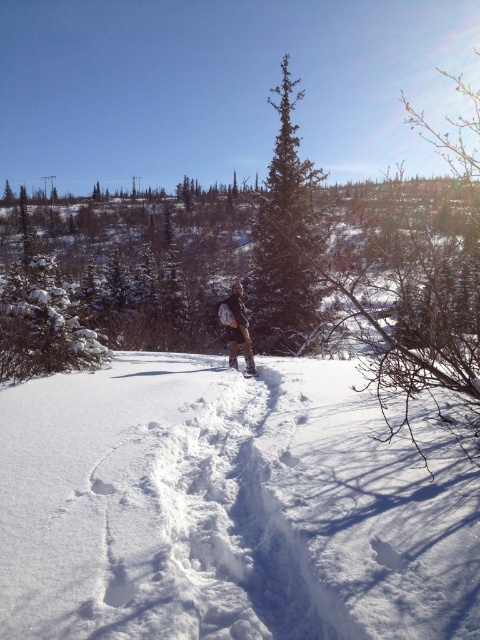
You are planning to take a photo of the white fluffy snow at center and brown fabric backpack at center. Which object should you focus on to ensure both are in the frame without moving the camera?

The white fluffy snow at center is wider than brown fabric backpack at center, so focusing on the white fluffy snow at center will ensure both are in the frame since it occupies more space.

You are a winter hiker planning to step onto the white rubber snowshoe at center. Based on the scene, is the green coniferous tree at center an obstacle in your path? Explain why or why not.

The green coniferous tree at center is located above the white rubber snowshoe at center, so it is positioned higher up and not directly in the path. Therefore, it is not an obstacle when stepping onto the snowshoe.

You are planning to take a photo of the winter landscape. You want to ensure that both the white fluffy snow at center and the brown fabric backpack at center are clearly visible. Which object should you focus on to make sure it is fully in frame?

The brown fabric backpack at center occupies more space than the white fluffy snow at center, so focusing on the brown fabric backpack at center will ensure it is fully in frame while the smaller snow area should still be visible.